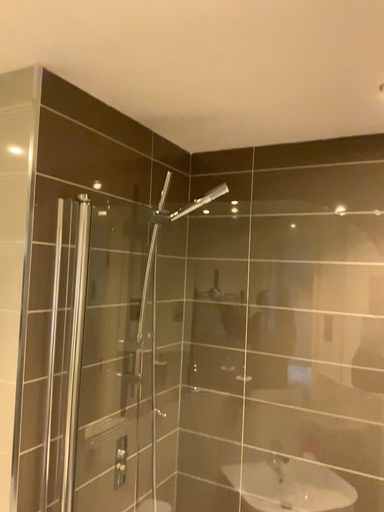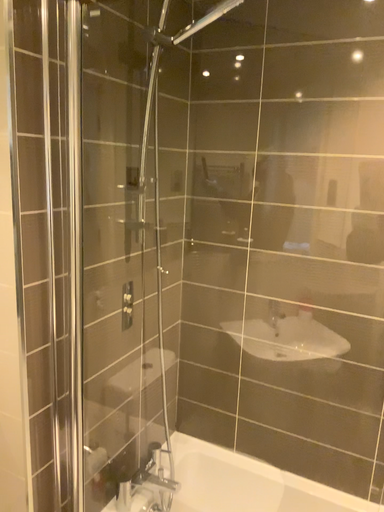
Question: How did the camera likely rotate when shooting the video?

Choices:
 (A) rotated downward
 (B) rotated upward

Answer: (A)